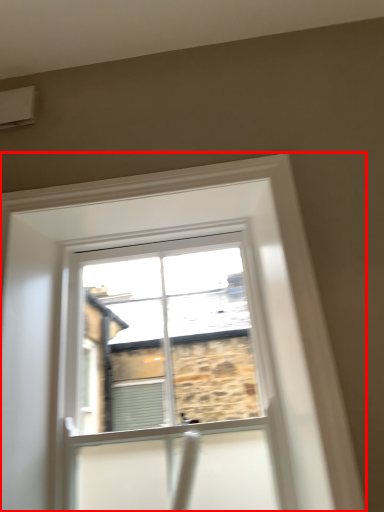
Question: Observing the image, what is the correct spatial positioning of window (annotated by the red box) in reference to air conditioning?

Choices:
 (A) left
 (B) right

Answer: (B)